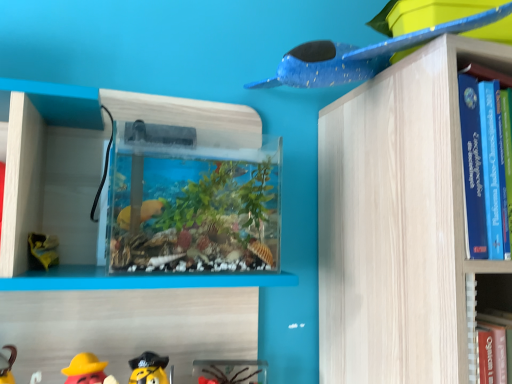
Question: From their relative heights in the image, would you say blue speckled plastic airplane at upper right, acting as the third toy starting from the left, is taller or shorter than rubber duck at lower left, the 2th toy in the top-to-bottom sequence?

Choices:
 (A) short
 (B) tall

Answer: (B)

Question: Is blue speckled plastic airplane at upper right, which is the 3th toy in bottom-to-top order, spatially inside rubber duck at lower left, the 1th toy positioned from the left, or outside of it?

Choices:
 (A) inside
 (B) outside

Answer: (B)

Question: Which is nearer to the rubber duck at lower left, the 3th toy positioned from the right?

Choices:
 (A) translucent plastic toy at lower center, which is the 2th toy in left-to-right order
 (B) blue speckled plastic airplane at upper right, the 1th toy positioned from the right

Answer: (A)

Question: Estimate the real-world distances between objects in this image. Which object is farther from the translucent plastic toy at lower center, positioned as the third toy in top-to-bottom order?

Choices:
 (A) blue speckled plastic airplane at upper right, which is the 3th toy in bottom-to-top order
 (B) rubber duck at lower left, the 1th toy positioned from the left

Answer: (A)